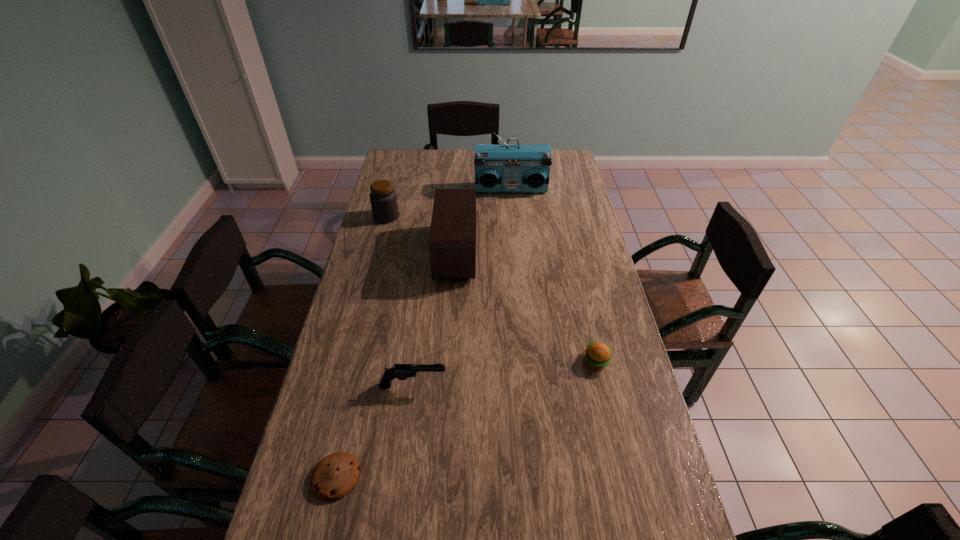
Find the location of a particular element. cookie is located at coordinates (334, 476).

The image size is (960, 540). I want to click on the nearest object, so click(x=334, y=476).

Find the location of a particular element. The image size is (960, 540). vacant space located on the front-facing side of the farther radio receiver is located at coordinates (516, 257).

Image resolution: width=960 pixels, height=540 pixels. What are the coordinates of `free spot located on the front-facing side of the shorter radio receiver` in the screenshot? It's located at (516, 253).

Locate an element on the screen. This screenshot has height=540, width=960. vacant region located 0.260m on the surface of the third tallest object near the warning symbol is located at coordinates (462, 217).

Where is `vacant position located 0.350m at the end of the barrel of the third shortest object`? This screenshot has height=540, width=960. vacant position located 0.350m at the end of the barrel of the third shortest object is located at coordinates (570, 385).

Identify the location of free spot located on the back of the fourth farthest object. (575, 266).

Where is `free point located 0.230m on the back of the nearest object`? The width and height of the screenshot is (960, 540). free point located 0.230m on the back of the nearest object is located at coordinates (359, 376).

Identify the location of jar that is at the left edge. The height and width of the screenshot is (540, 960). (383, 199).

I want to click on gun that is at the left edge, so click(400, 371).